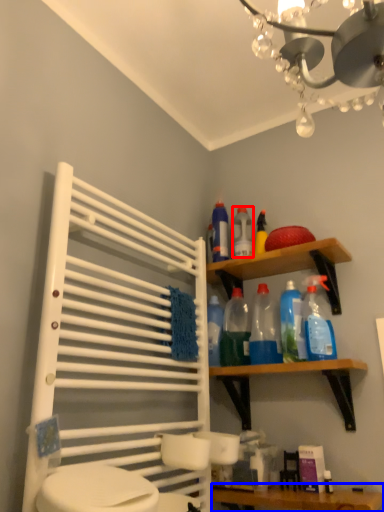
Question: Which object appears farthest to the camera in this image, bottle (highlighted by a red box) or vanity (highlighted by a blue box)?

Choices:
 (A) bottle
 (B) vanity

Answer: (A)